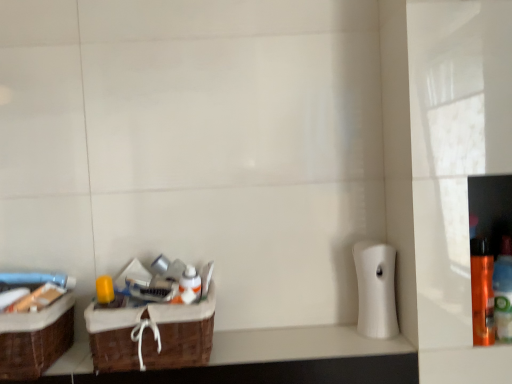
Locate an element on the screen. blank space above brown woven basket at lower left, which is the second box from left to right (from a real-world perspective) is located at coordinates (154, 292).